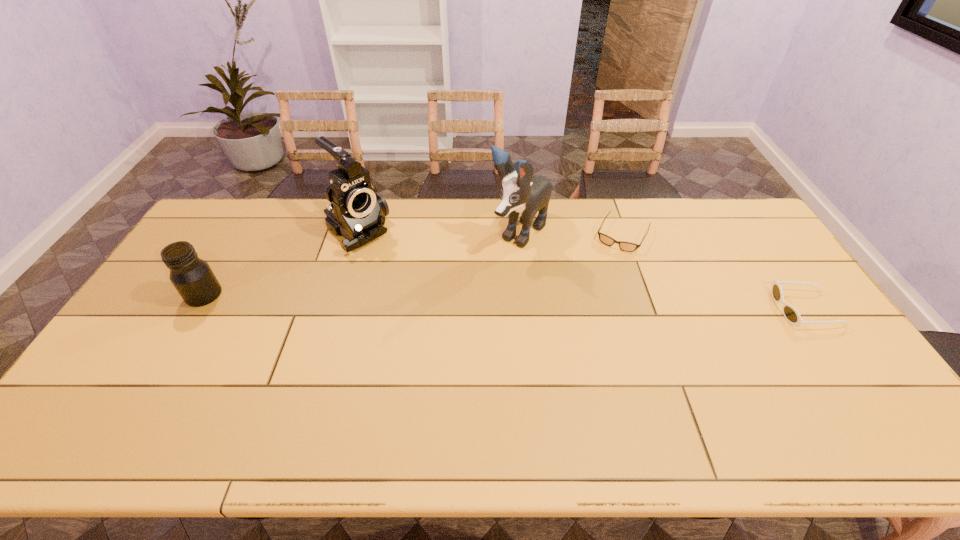
You are a GUI agent. You are given a task and a screenshot of the screen. Output one action in this format:
    pyautogui.click(x=<x>, y=<y>)
    Task: Click on the free point located on the front-facing side of the shorter sunglasses
    The image size is (960, 540).
    Given the screenshot: What is the action you would take?
    pyautogui.click(x=610, y=260)

Find the location of a particular element. free space located on the front-facing side of the shorter sunglasses is located at coordinates (609, 262).

Find the location of a particular element. Image resolution: width=960 pixels, height=540 pixels. free space located on the front-facing side of the shorter sunglasses is located at coordinates (597, 285).

This screenshot has width=960, height=540. Find the location of `puppy that is at the far edge`. puppy that is at the far edge is located at coordinates (522, 192).

Where is `camcorder that is at the far edge`? camcorder that is at the far edge is located at coordinates (357, 212).

Find the location of a particular element. sunglasses at the far edge is located at coordinates (605, 239).

This screenshot has height=540, width=960. In order to click on object positioned at the left edge in this screenshot , I will do (192, 277).

Image resolution: width=960 pixels, height=540 pixels. In order to click on object at the right edge in this screenshot , I will do `click(790, 313)`.

Image resolution: width=960 pixels, height=540 pixels. Identify the location of free space at the far edge. (492, 220).

In the image, there is a desktop. Where is `vacant space at the near edge`? This screenshot has width=960, height=540. vacant space at the near edge is located at coordinates (575, 400).